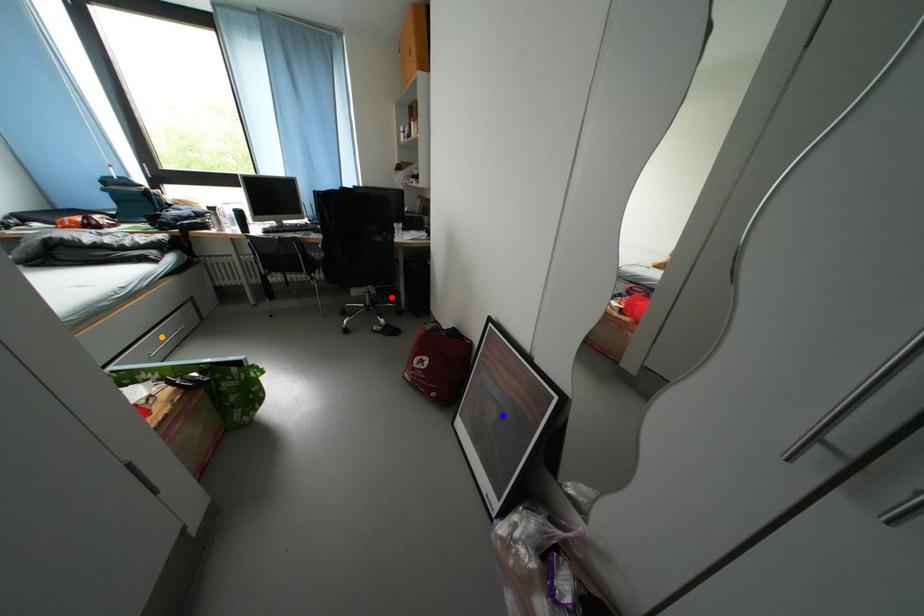
Order these from nearest to farthest:
1. blue point
2. orange point
3. red point

blue point → orange point → red point